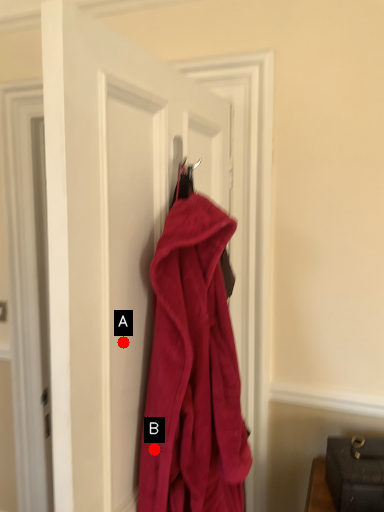
Question: Two points are circled on the image, labeled by A and B beside each circle. Which point is farther from the camera taking this photo?

Choices:
 (A) A is further
 (B) B is further

Answer: (B)